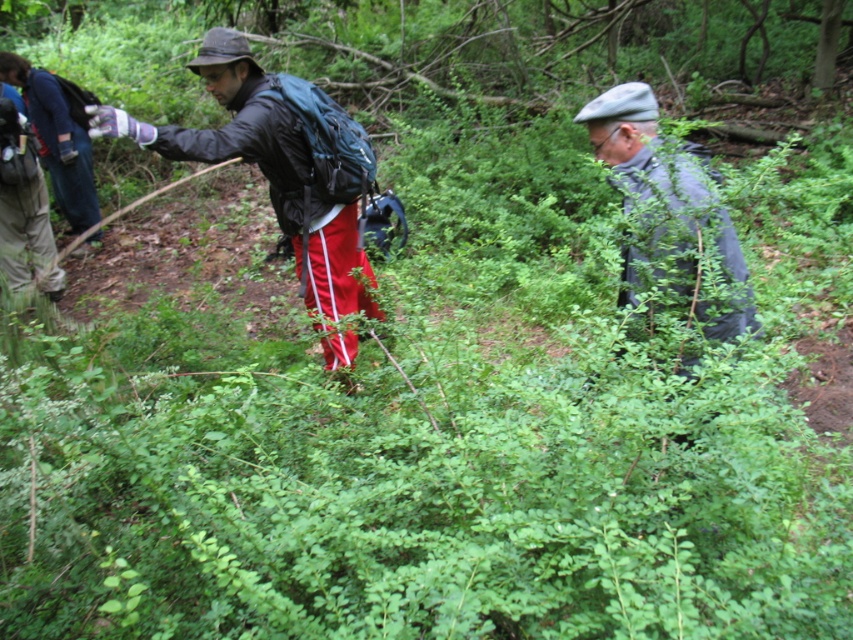
You are a hiker trying to identify clothing items in the scene. Which jacket is covering the other one, the matte black jacket at center or the gray fabric jacket at center?

The matte black jacket at center is positioned over the gray fabric jacket at center, so it is covering the gray fabric jacket at center.

You are standing in the forest and want to locate the matte black jacket at center. According to the coordinates provided, where should you look relative to the center of the image?

The matte black jacket at center is located at coordinates point (276, 164). Since the center of the image is at (426, 320), this means the matte black jacket at center is positioned to the left and slightly above the center of the image.

You are a hiker who needs to pass between the matte black jacket at center and the gray fabric jacket at center. Your backpack is 2 feet wide. Can you fit through the space between them?

The matte black jacket at center and gray fabric jacket at center are 4.43 feet apart from each other. Since your backpack is 2 feet wide, you can easily pass through the space between them as the distance is more than sufficient for your backpack width.